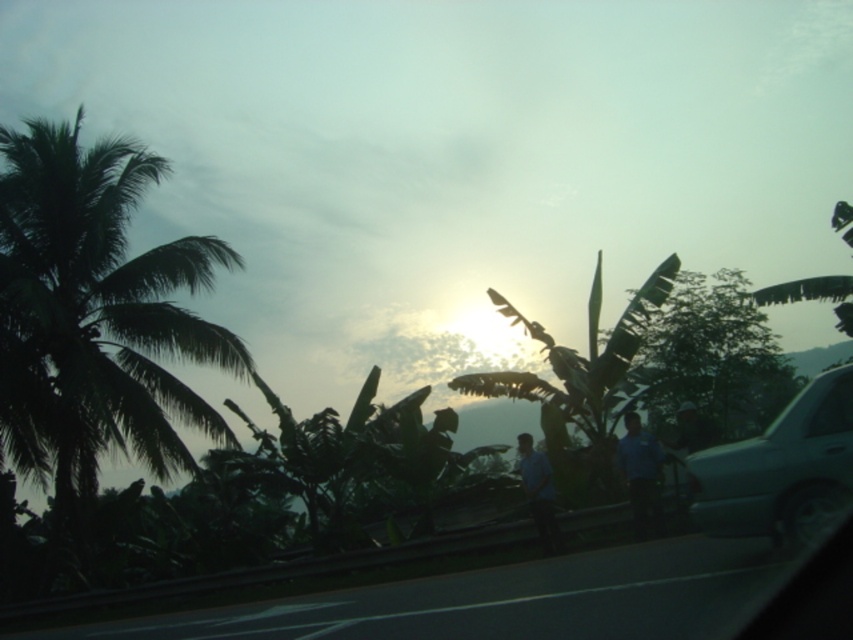
Does blue uniform shirt at center come behind transparent glass car window at right?

Yes, blue uniform shirt at center is further from the viewer.

Can you confirm if blue uniform shirt at center is bigger than transparent glass car window at right?

Yes.

Which is in front, point (627, 460) or point (833, 410)?

Positioned in front is point (833, 410).

Locate an element on the screen. The width and height of the screenshot is (853, 640). blue uniform shirt at center is located at coordinates (641, 476).

From the picture: Which is below, green leafy coconut tree at center or transparent glass car window at right?

transparent glass car window at right is lower down.

Where is `green leafy coconut tree at center`? The image size is (853, 640). green leafy coconut tree at center is located at coordinates (581, 371).

You are a GUI agent. You are given a task and a screenshot of the screen. Output one action in this format:
    pyautogui.click(x=<x>, y=<y>)
    Task: Click on the green leafy coconut tree at center
    
    Given the screenshot: What is the action you would take?
    pyautogui.click(x=581, y=371)

Is dark green leafy palm tree at left wider than blue uniform shirt at center?

Correct, the width of dark green leafy palm tree at left exceeds that of blue uniform shirt at center.

Who is higher up, dark green leafy palm tree at left or blue uniform shirt at center?

dark green leafy palm tree at left is higher up.

In order to click on dark green leafy palm tree at left in this screenshot , I will do `click(96, 317)`.